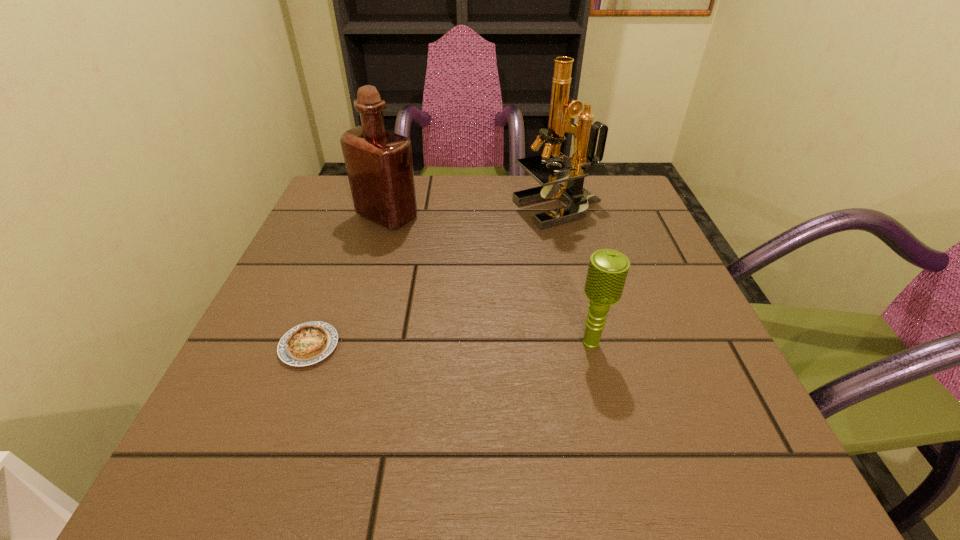
Find the location of a particular element. This screenshot has height=540, width=960. microscope situated at the far edge is located at coordinates (562, 108).

Identify the location of liquor situated at the far edge. The image size is (960, 540). (379, 164).

You are a GUI agent. You are given a task and a screenshot of the screen. Output one action in this format:
    pyautogui.click(x=<x>, y=<y>)
    Task: Click on the liquor that is positioned at the left edge
    
    Given the screenshot: What is the action you would take?
    pyautogui.click(x=379, y=164)

The height and width of the screenshot is (540, 960). What are the coordinates of `quiche located at the left edge` in the screenshot? It's located at (308, 343).

Where is `object that is at the right edge`? Image resolution: width=960 pixels, height=540 pixels. object that is at the right edge is located at coordinates (562, 108).

Where is `object at the far left corner`? Image resolution: width=960 pixels, height=540 pixels. object at the far left corner is located at coordinates (379, 164).

Find the location of `object that is positioned at the far right corner`. object that is positioned at the far right corner is located at coordinates (562, 108).

In the image, there is a desktop. Identify the location of vacant space at the far edge. (424, 215).

Locate an element on the screen. This screenshot has height=540, width=960. free location at the near edge of the desktop is located at coordinates (613, 445).

In the image, there is a desktop. Where is `free region at the left edge`? Image resolution: width=960 pixels, height=540 pixels. free region at the left edge is located at coordinates tap(304, 295).